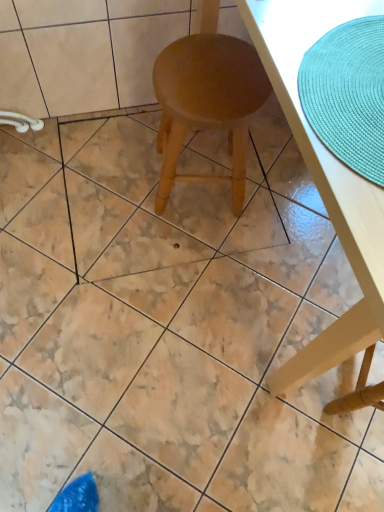
Question: Does light brown wood stool at center have a lesser height compared to wooden table at center?

Choices:
 (A) no
 (B) yes

Answer: (B)

Question: Does light brown wood stool at center turn towards wooden table at center?

Choices:
 (A) no
 (B) yes

Answer: (B)

Question: From the image's perspective, would you say light brown wood stool at center is shown under wooden table at center?

Choices:
 (A) yes
 (B) no

Answer: (B)

Question: From a real-world perspective, is light brown wood stool at center on wooden table at center?

Choices:
 (A) no
 (B) yes

Answer: (A)

Question: Can you confirm if light brown wood stool at center is thinner than wooden table at center?

Choices:
 (A) yes
 (B) no

Answer: (A)

Question: Relative to teal woven placemat at upper right, is light brown wood stool at center in front or behind?

Choices:
 (A) front
 (B) behind

Answer: (B)

Question: From their relative heights in the image, would you say light brown wood stool at center is taller or shorter than teal woven placemat at upper right?

Choices:
 (A) short
 (B) tall

Answer: (B)

Question: Based on their sizes in the image, would you say light brown wood stool at center is bigger or smaller than teal woven placemat at upper right?

Choices:
 (A) small
 (B) big

Answer: (B)

Question: From a real-world perspective, is light brown wood stool at center positioned above or below teal woven placemat at upper right?

Choices:
 (A) below
 (B) above

Answer: (A)

Question: From the image's perspective, is teal woven placemat at upper right above or below light brown wood stool at center?

Choices:
 (A) below
 (B) above

Answer: (A)

Question: In terms of height, does teal woven placemat at upper right look taller or shorter compared to light brown wood stool at center?

Choices:
 (A) short
 (B) tall

Answer: (A)

Question: Is teal woven placemat at upper right inside the boundaries of light brown wood stool at center, or outside?

Choices:
 (A) inside
 (B) outside

Answer: (B)

Question: Based on their positions, is teal woven placemat at upper right located to the left or right of light brown wood stool at center?

Choices:
 (A) right
 (B) left

Answer: (A)

Question: Looking at the image, does wooden table at center seem bigger or smaller compared to light brown wood stool at center?

Choices:
 (A) big
 (B) small

Answer: (A)

Question: Considering the positions of wooden table at center and light brown wood stool at center in the image, is wooden table at center wider or thinner than light brown wood stool at center?

Choices:
 (A) wide
 (B) thin

Answer: (A)